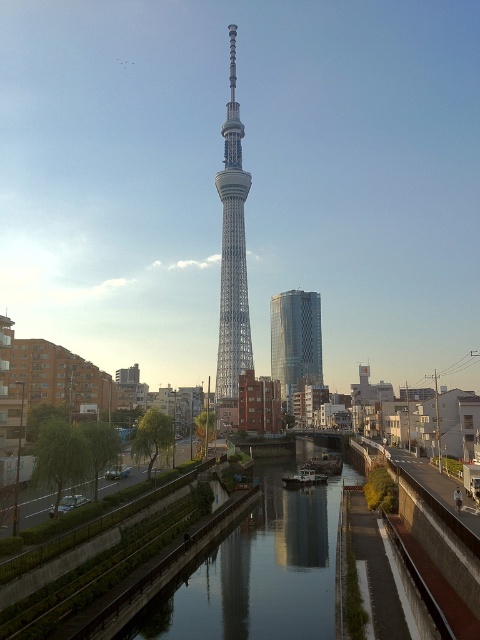
Who is positioned more to the left, silver metallic tower at center or shiny glass skyscraper at center?

silver metallic tower at center is more to the left.

Which is more to the right, silver metallic tower at center or shiny glass skyscraper at center?

From the viewer's perspective, shiny glass skyscraper at center appears more on the right side.

Find the location of a particular element. silver metallic tower at center is located at coordinates (232, 250).

Who is taller, smooth concrete canal at center or silver metallic tower at center?

With more height is silver metallic tower at center.

Is smooth concrete canal at center above silver metallic tower at center?

Actually, smooth concrete canal at center is below silver metallic tower at center.

Where is `smooth concrete canal at center`? This screenshot has height=640, width=480. smooth concrete canal at center is located at coordinates (260, 570).

Is smooth concrete canal at center taller than shiny glass skyscraper at center?

No.

Where is `smooth concrete canal at center`? The height and width of the screenshot is (640, 480). smooth concrete canal at center is located at coordinates (260, 570).

Does point (267, 564) come in front of point (304, 308)?

Yes.

What are the coordinates of `smooth concrete canal at center` in the screenshot? It's located at (260, 570).